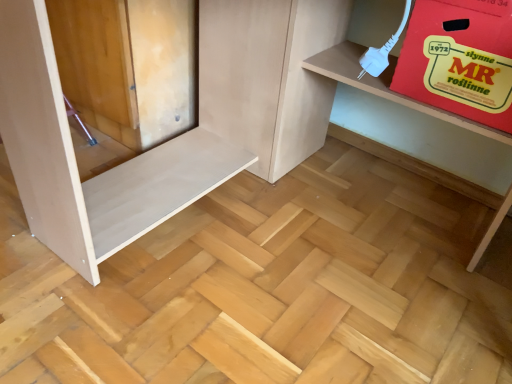
Image resolution: width=512 pixels, height=384 pixels. What do you see at coordinates (178, 136) in the screenshot?
I see `matte cardboard box at upper right` at bounding box center [178, 136].

Image resolution: width=512 pixels, height=384 pixels. What are the coordinates of `matte cardboard box at upper right` in the screenshot? It's located at (178, 136).

This screenshot has height=384, width=512. What do you see at coordinates (460, 59) in the screenshot?
I see `red cardboard box at upper right` at bounding box center [460, 59].

The height and width of the screenshot is (384, 512). In order to click on red cardboard box at upper right in this screenshot , I will do [x=460, y=59].

Locate an element on the screen. The image size is (512, 384). matte cardboard box at upper right is located at coordinates (178, 136).

Is matte cardboard box at upper right at the left side of red cardboard box at upper right?

Yes.

Between matte cardboard box at upper right and red cardboard box at upper right, which one is positioned in front?

matte cardboard box at upper right is in front.

Considering the positions of points (32, 207) and (502, 115), is point (32, 207) closer to camera compared to point (502, 115)?

No, (32, 207) is further to viewer.

From the image's perspective, is matte cardboard box at upper right on top of red cardboard box at upper right?

No, from the image's perspective, matte cardboard box at upper right is not on top of red cardboard box at upper right.

From a real-world perspective, is matte cardboard box at upper right physically located above or below red cardboard box at upper right?

matte cardboard box at upper right is below red cardboard box at upper right.

Can you confirm if matte cardboard box at upper right is thinner than red cardboard box at upper right?

Incorrect, the width of matte cardboard box at upper right is not less than that of red cardboard box at upper right.

Considering the sizes of objects matte cardboard box at upper right and red cardboard box at upper right in the image provided, who is shorter, matte cardboard box at upper right or red cardboard box at upper right?

red cardboard box at upper right.

Consider the image. Can you confirm if matte cardboard box at upper right is smaller than red cardboard box at upper right?

No.

Is matte cardboard box at upper right not within red cardboard box at upper right?

Yes, matte cardboard box at upper right is outside of red cardboard box at upper right.

Consider the image. Would you say matte cardboard box at upper right is a long distance from red cardboard box at upper right?

That's not correct — matte cardboard box at upper right is a little close to red cardboard box at upper right.

Is matte cardboard box at upper right oriented towards red cardboard box at upper right?

No, matte cardboard box at upper right is not aimed at red cardboard box at upper right.

At what (x,y) coordinates should I click in order to perform the action: click on furniture beneath the red cardboard box at upper right (from a real-world perspective). Please return your answer as a coordinate pair (x, y). Image resolution: width=512 pixels, height=384 pixels. Looking at the image, I should click on (178, 136).

Looking at this image, is red cardboard box at upper right to the left or to the right of matte cardboard box at upper right in the image?

Clearly, red cardboard box at upper right is on the right of matte cardboard box at upper right in the image.

Is the depth of red cardboard box at upper right greater than that of matte cardboard box at upper right?

Yes, it is behind matte cardboard box at upper right.

Is point (440, 49) closer or farther from the camera than point (237, 21)?

Point (440, 49) is positioned closer to the camera compared to point (237, 21).

From the image's perspective, is red cardboard box at upper right under matte cardboard box at upper right?

No.

From a real-world perspective, is red cardboard box at upper right positioned above or below matte cardboard box at upper right?

red cardboard box at upper right is above matte cardboard box at upper right.

In terms of width, does red cardboard box at upper right look wider or thinner when compared to matte cardboard box at upper right?

Clearly, red cardboard box at upper right has less width compared to matte cardboard box at upper right.

Between red cardboard box at upper right and matte cardboard box at upper right, which one has more height?

With more height is matte cardboard box at upper right.

Can you confirm if red cardboard box at upper right is smaller than matte cardboard box at upper right?

Yes, red cardboard box at upper right is smaller than matte cardboard box at upper right.

Can we say red cardboard box at upper right lies outside matte cardboard box at upper right?

Actually, red cardboard box at upper right is at least partially inside matte cardboard box at upper right.

Would you consider red cardboard box at upper right to be distant from matte cardboard box at upper right?

red cardboard box at upper right is near matte cardboard box at upper right, not far away.

Is matte cardboard box at upper right at the back of red cardboard box at upper right?

Yes, red cardboard box at upper right is facing away from matte cardboard box at upper right.

Find the location of a particular element. cardboard box behind the matte cardboard box at upper right is located at coordinates (460, 59).

Locate an element on the screen. furniture in front of the red cardboard box at upper right is located at coordinates (178, 136).

This screenshot has width=512, height=384. In the image, there is a matte cardboard box at upper right. In order to click on cardboard box above it (from the image's perspective) in this screenshot , I will do `click(460, 59)`.